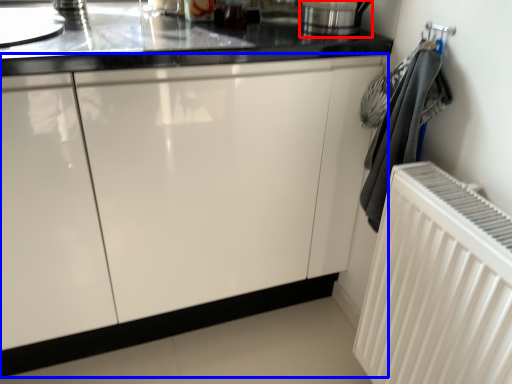
Question: Among these objects, which one is farthest to the camera, appliance (highlighted by a red box) or cabinetry (highlighted by a blue box)?

Choices:
 (A) appliance
 (B) cabinetry

Answer: (A)